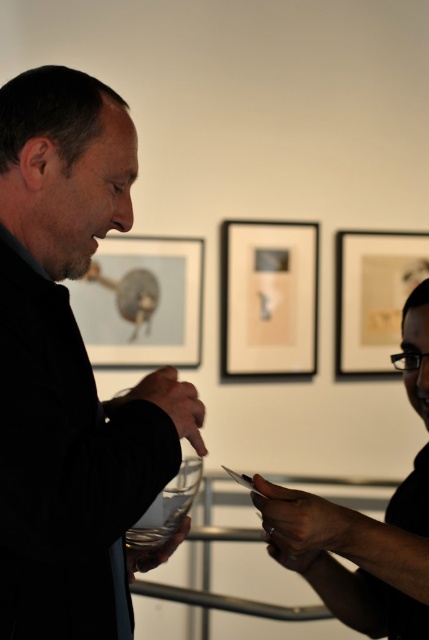
How far apart are matte black picture frame at center and matte paper picture frame at upper right?

A: matte black picture frame at center is 31.92 centimeters away from matte paper picture frame at upper right.

Is matte black picture frame at center further to camera compared to matte paper picture frame at upper right?

No, matte black picture frame at center is closer to the viewer.

Is point (296, 332) closer to camera compared to point (347, 257)?

Yes, it is in front of point (347, 257).

Where is `matte black picture frame at center`? matte black picture frame at center is located at coordinates (268, 298).

Can you confirm if black matte jacket at left is bigger than matte glass picture frame at upper left?

Correct, black matte jacket at left is larger in size than matte glass picture frame at upper left.

Who is positioned more to the left, black matte jacket at left or matte glass picture frame at upper left?

Positioned to the left is matte glass picture frame at upper left.

Between point (12, 371) and point (111, 307), which one is positioned behind?

Point (111, 307)

Where is `black matte jacket at left`? black matte jacket at left is located at coordinates (71, 371).

Between matte paper picture frame at upper right and transparent glass at center, which one has less height?

transparent glass at center is shorter.

Is matte paper picture frame at upper right smaller than transparent glass at center?

Incorrect, matte paper picture frame at upper right is not smaller in size than transparent glass at center.

Is point (353, 362) more distant than point (171, 515)?

Yes, point (353, 362) is farther from viewer.

I want to click on matte paper picture frame at upper right, so click(x=372, y=296).